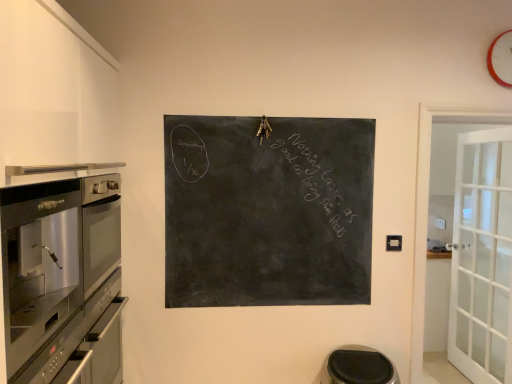
The width and height of the screenshot is (512, 384). I want to click on orange plastic clock at upper right, so click(x=501, y=59).

What is the approximate height of black rubber step stool at lower center?

26.55 centimeters.

What is the approximate height of stainless steel oven at left?

It is 25.78 inches.

At what (x,y) coordinates should I click in order to perform the action: click on black chalkboard at center. Please return your answer as a coordinate pair (x, y). Image resolution: width=512 pixels, height=384 pixels. Looking at the image, I should click on (268, 211).

Consider the image. Is black rubber step stool at lower center a part of black chalkboard at center?

No, black rubber step stool at lower center is located outside of black chalkboard at center.

Is black chalkboard at center smaller than black rubber step stool at lower center?

Incorrect, black chalkboard at center is not smaller in size than black rubber step stool at lower center.

Based on the photo, which of these two, black chalkboard at center or black rubber step stool at lower center, is wider?

With larger width is black rubber step stool at lower center.

From a real-world perspective, is black chalkboard at center physically located above or below black rubber step stool at lower center?

From a real-world perspective, black chalkboard at center is physically above black rubber step stool at lower center.

Locate an element on the screen. The width and height of the screenshot is (512, 384). clock above the black chalkboard at center (from a real-world perspective) is located at coordinates (501, 59).

Is black chalkboard at center bigger than orange plastic clock at upper right?

Yes, black chalkboard at center is bigger than orange plastic clock at upper right.

From a real-world perspective, is black chalkboard at center physically located above or below orange plastic clock at upper right?

In terms of real-world spatial position, black chalkboard at center is below orange plastic clock at upper right.

Which point is more distant from viewer, (327, 134) or (502, 77)?

Positioned behind is point (502, 77).

Which is in front, black rubber step stool at lower center or black chalkboard at center?

black rubber step stool at lower center.

How different are the orientations of black rubber step stool at lower center and black chalkboard at center in degrees?

The angle between the facing direction of black rubber step stool at lower center and the facing direction of black chalkboard at center is 0.88 degrees.

Is black rubber step stool at lower center with black chalkboard at center?

No, black rubber step stool at lower center is not making contact with black chalkboard at center.

Consider the image. From a real-world perspective, is black rubber step stool at lower center above or below black chalkboard at center?

black rubber step stool at lower center is situated lower than black chalkboard at center in the real world.

Does black chalkboard at center turn towards stainless steel oven at left?

No, black chalkboard at center is not facing towards stainless steel oven at left.

Consider the image. Is black chalkboard at center bigger than stainless steel oven at left?

No, black chalkboard at center is not bigger than stainless steel oven at left.

From a real-world perspective, who is located lower, black chalkboard at center or stainless steel oven at left?

stainless steel oven at left.

From the image's perspective, between black chalkboard at center and stainless steel oven at left, which one is located above?

black chalkboard at center, from the image's perspective.

From the image's perspective, relative to stainless steel oven at left, is black rubber step stool at lower center above or below?

Based on their image positions, black rubber step stool at lower center is located beneath stainless steel oven at left.

Which is in front, black rubber step stool at lower center or stainless steel oven at left?

Positioned in front is stainless steel oven at left.

Based on their positions, is black rubber step stool at lower center located to the left or right of stainless steel oven at left?

black rubber step stool at lower center is to the right of stainless steel oven at left.

Is black rubber step stool at lower center situated inside stainless steel oven at left or outside?

black rubber step stool at lower center lies outside stainless steel oven at left.

Is point (50, 239) behind point (359, 160)?

No, it is not.

Could you tell me if stainless steel oven at left is facing black chalkboard at center?

Yes, stainless steel oven at left is facing black chalkboard at center.

From their relative heights in the image, would you say stainless steel oven at left is taller or shorter than black chalkboard at center?

stainless steel oven at left is shorter than black chalkboard at center.

Between stainless steel oven at left and black chalkboard at center, which one has larger size?

Bigger between the two is stainless steel oven at left.

Considering the sizes of objects orange plastic clock at upper right and black rubber step stool at lower center in the image provided, who is taller, orange plastic clock at upper right or black rubber step stool at lower center?

With more height is orange plastic clock at upper right.

Is black rubber step stool at lower center at the back of orange plastic clock at upper right?

No.

Does point (503, 48) come farther from viewer compared to point (332, 365)?

That is True.

Is orange plastic clock at upper right smaller than black rubber step stool at lower center?

Yes.

The height and width of the screenshot is (384, 512). What are the coordinates of `step stool on the right of black chalkboard at center` in the screenshot? It's located at (358, 367).

This screenshot has width=512, height=384. What are the coordinates of `bulletin board on the left of orange plastic clock at upper right` in the screenshot? It's located at (268, 211).

In the scene shown: Which object lies further to the anchor point orange plastic clock at upper right, black chalkboard at center or stainless steel oven at left?

stainless steel oven at left is further to orange plastic clock at upper right.

Based on the photo, looking at the image, which one is located closer to stainless steel oven at left, black rubber step stool at lower center or orange plastic clock at upper right?

Among the two, black rubber step stool at lower center is located nearer to stainless steel oven at left.

Looking at the image, which one is located closer to orange plastic clock at upper right, stainless steel oven at left or black chalkboard at center?

black chalkboard at center is closer to orange plastic clock at upper right.

Looking at the image, which one is located further to black rubber step stool at lower center, orange plastic clock at upper right or stainless steel oven at left?

orange plastic clock at upper right is positioned further to the anchor black rubber step stool at lower center.

Considering their positions, is stainless steel oven at left positioned closer to orange plastic clock at upper right than black rubber step stool at lower center?

Based on the image, black rubber step stool at lower center appears to be nearer to orange plastic clock at upper right.

Based on their spatial positions, is black chalkboard at center or black rubber step stool at lower center closer to stainless steel oven at left?

Among the two, black chalkboard at center is located nearer to stainless steel oven at left.

Which object lies further to the anchor point black chalkboard at center, orange plastic clock at upper right or stainless steel oven at left?

The object further to black chalkboard at center is orange plastic clock at upper right.

Consider the image. From the image, which object appears to be nearer to orange plastic clock at upper right, black rubber step stool at lower center or stainless steel oven at left?

black rubber step stool at lower center lies closer to orange plastic clock at upper right than the other object.

Image resolution: width=512 pixels, height=384 pixels. Identify the location of bulletin board between orange plastic clock at upper right and black rubber step stool at lower center from top to bottom. (268, 211).

Locate an element on the screen. bulletin board between stainless steel oven at left and black rubber step stool at lower center in the horizontal direction is located at coordinates (268, 211).

Locate an element on the screen. The image size is (512, 384). step stool between stainless steel oven at left and orange plastic clock at upper right is located at coordinates (358, 367).

I want to click on bulletin board between stainless steel oven at left and orange plastic clock at upper right from left to right, so click(268, 211).